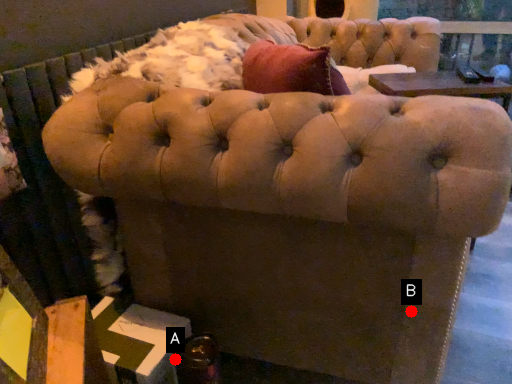
Question: Two points are circled on the image, labeled by A and B beside each circle. Which point is closer to the camera?

Choices:
 (A) A is closer
 (B) B is closer

Answer: (B)